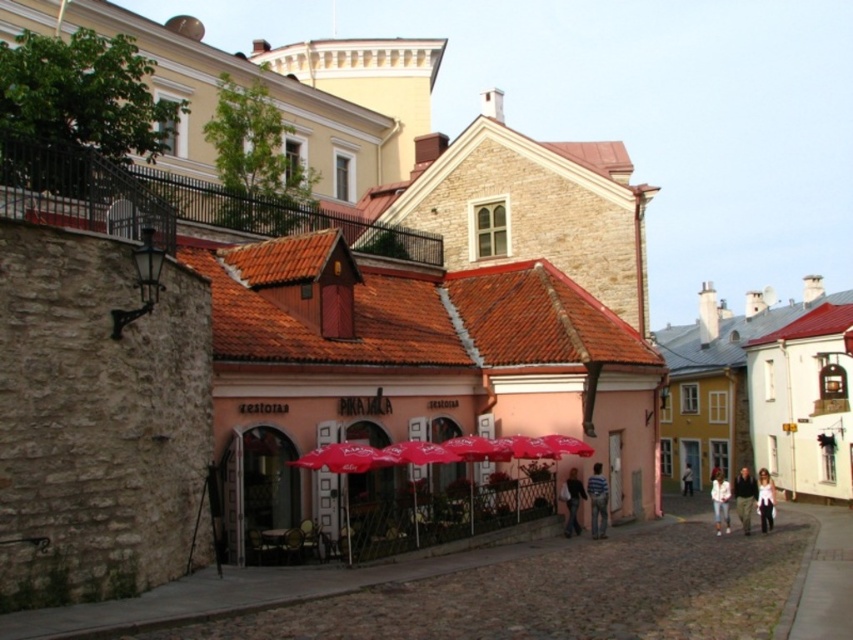
Can you confirm if pink matte building at center is taller than red fabric umbrella at center?

Correct, pink matte building at center is much taller as red fabric umbrella at center.

Who is positioned more to the right, pink matte building at center or red fabric umbrella at center?

pink matte building at center is more to the right.

Between point (399, 545) and point (340, 454), which one is positioned behind?

Point (399, 545)

What are the coordinates of `pink matte building at center` in the screenshot? It's located at (413, 394).

Consider the image. Does pink matte building at center appear under white cotton shirt at center?

No, pink matte building at center is not below white cotton shirt at center.

Which is more to the left, pink matte building at center or white cotton shirt at center?

pink matte building at center

Is point (363, 518) closer to viewer compared to point (692, 490)?

Yes, it is in front of point (692, 490).

This screenshot has width=853, height=640. What are the coordinates of `pink matte building at center` in the screenshot? It's located at (413, 394).

Is dark blue jeans at center bigger than white cotton shirt at center?

Incorrect, dark blue jeans at center is not larger than white cotton shirt at center.

Can you confirm if dark blue jeans at center is smaller than white cotton shirt at center?

Yes.

Is point (577, 493) positioned before point (683, 476)?

Yes, it is in front of point (683, 476).

Locate an element on the screen. Image resolution: width=853 pixels, height=640 pixels. dark blue jeans at center is located at coordinates (572, 502).